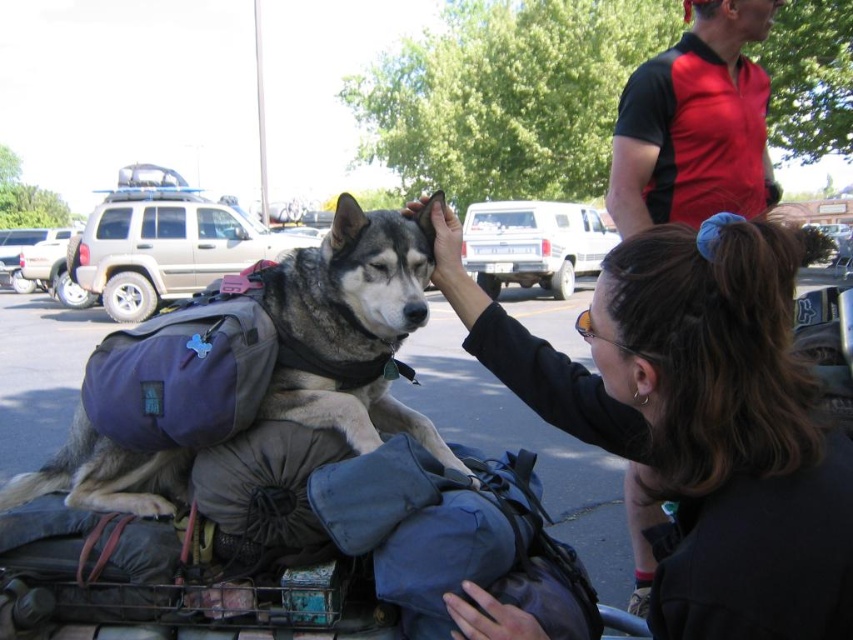
Question: Is gray-furred backpack at left smaller than red/black polo shirt at upper right?

Choices:
 (A) yes
 (B) no

Answer: (A)

Question: Estimate the real-world distances between objects in this image. Which object is closer to the gray-furred backpack at left?

Choices:
 (A) red/black polo shirt at upper right
 (B) dark brown hair at center

Answer: (B)

Question: Can you confirm if gray-furred backpack at left is positioned below red/black polo shirt at upper right?

Choices:
 (A) yes
 (B) no

Answer: (A)

Question: Does gray-furred backpack at left appear under red/black polo shirt at upper right?

Choices:
 (A) no
 (B) yes

Answer: (B)

Question: Which point is farther to the camera?

Choices:
 (A) dark brown hair at center
 (B) gray-furred backpack at left
 (C) red/black polo shirt at upper right

Answer: (C)

Question: Which point appears closest to the camera in this image?

Choices:
 (A) (722, 10)
 (B) (119, 461)
 (C) (637, 276)

Answer: (C)